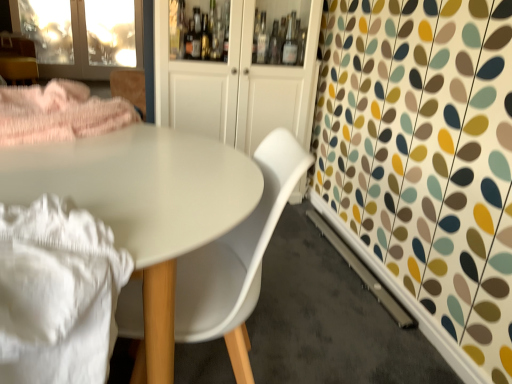
Question: From the image's perspective, would you say transparent glass screen door at upper left is shown under white glossy cabinet at center?

Choices:
 (A) no
 (B) yes

Answer: (A)

Question: From a real-world perspective, is transparent glass screen door at upper left positioned under white glossy cabinet at center based on gravity?

Choices:
 (A) no
 (B) yes

Answer: (B)

Question: Does transparent glass screen door at upper left have a smaller size compared to white glossy cabinet at center?

Choices:
 (A) no
 (B) yes

Answer: (B)

Question: Is transparent glass screen door at upper left wider than white glossy cabinet at center?

Choices:
 (A) no
 (B) yes

Answer: (A)

Question: Does transparent glass screen door at upper left appear on the left side of white glossy cabinet at center?

Choices:
 (A) yes
 (B) no

Answer: (A)

Question: Is transparent glass screen door at upper left shorter than white glossy cabinet at center?

Choices:
 (A) no
 (B) yes

Answer: (B)

Question: From the image's perspective, is white cotton blanket at lower left below matte white table at center?

Choices:
 (A) no
 (B) yes

Answer: (A)

Question: From a real-world perspective, is white cotton blanket at lower left on top of matte white table at center?

Choices:
 (A) yes
 (B) no

Answer: (A)

Question: From the image's perspective, is white cotton blanket at lower left on top of matte white table at center?

Choices:
 (A) no
 (B) yes

Answer: (B)

Question: Considering the relative positions of white cotton blanket at lower left and matte white table at center in the image provided, is white cotton blanket at lower left to the left of matte white table at center from the viewer's perspective?

Choices:
 (A) no
 (B) yes

Answer: (B)

Question: Considering the relative sizes of white cotton blanket at lower left and matte white table at center in the image provided, is white cotton blanket at lower left wider than matte white table at center?

Choices:
 (A) yes
 (B) no

Answer: (B)

Question: Considering the relative sizes of white cotton blanket at lower left and matte white table at center in the image provided, is white cotton blanket at lower left taller than matte white table at center?

Choices:
 (A) no
 (B) yes

Answer: (A)

Question: Would you say white glossy cabinet at center is outside matte white table at center?

Choices:
 (A) yes
 (B) no

Answer: (A)